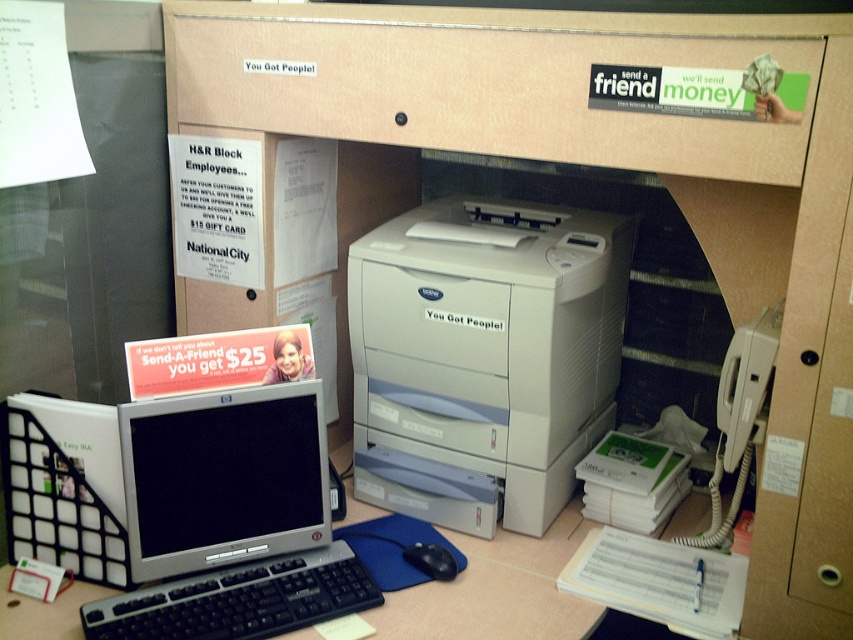
You are organizing the office supplies in the cubicle. You need to place a new label maker that requires space next to the white matte printer at center and the silver metallic monitor at lower left. Based on their current positions, which object is to the left of the other?

The silver metallic monitor at lower left is to the left of the white matte printer at center.